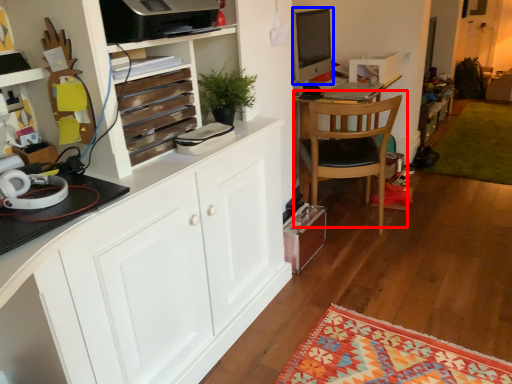
Question: Which object is further to the camera taking this photo, chair (highlighted by a red box) or desktop computer (highlighted by a blue box)?

Choices:
 (A) chair
 (B) desktop computer

Answer: (B)